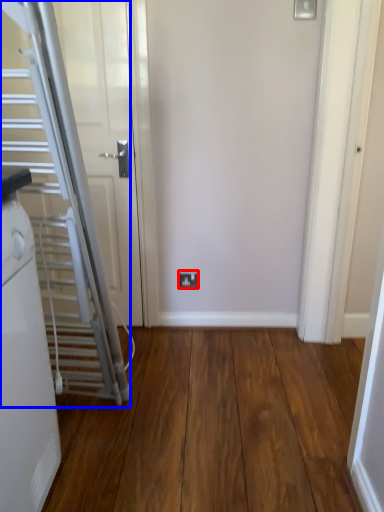
Question: Which object is closer to the camera taking this photo, electric outlet (highlighted by a red box) or escalator (highlighted by a blue box)?

Choices:
 (A) electric outlet
 (B) escalator

Answer: (B)